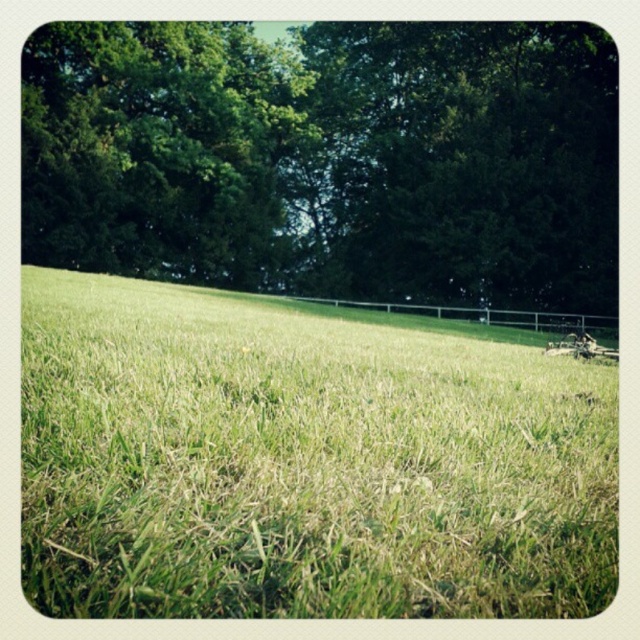
Question: Which object is the closest to the green leafy tree at upper center?

Choices:
 (A) green leafy tree at upper left
 (B) green grass at center

Answer: (A)

Question: Estimate the real-world distances between objects in this image. Which object is farther from the green grass at center?

Choices:
 (A) green leafy tree at upper center
 (B) green leafy tree at upper left

Answer: (A)

Question: Which of the following is the closest to the observer?

Choices:
 (A) green grass at center
 (B) green leafy tree at upper center

Answer: (A)

Question: Is green grass at center bigger than green leafy tree at upper left?

Choices:
 (A) no
 (B) yes

Answer: (A)

Question: Does green grass at center appear on the left side of green leafy tree at upper center?

Choices:
 (A) no
 (B) yes

Answer: (A)

Question: Can you confirm if green leafy tree at upper center is smaller than green leafy tree at upper left?

Choices:
 (A) yes
 (B) no

Answer: (B)